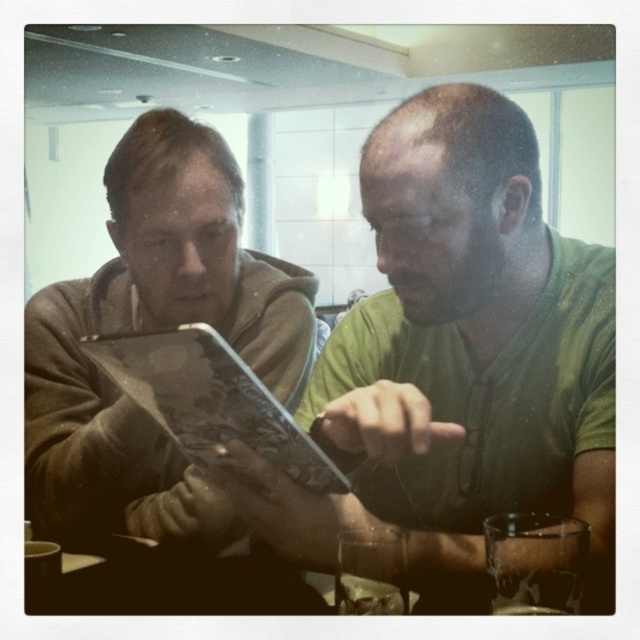
You are a photographer trying to capture a closeup of the matte brown hoodie at left. The camera you are using has a focal length of 50mm. To ensure the subject fills the frame, you need to position yourself at a specific distance. Given that the hoodie is at coordinates point 0.514, 0.241, can you determine if you should stand closer to the center of the room or move towards the edges?

The matte brown hoodie at left is located at point (154, 328), which is closer to the left side of the frame. To capture a closeup, you should move towards the edges of the room to get closer to the matte brown hoodie at left.

Looking at this image, you are a delivery person who needs to place a small package between the green matte shirt at center and the matte black tablet at center. The package is 15 centimeters long. Can you fit it between them without moving either object?

The distance between the green matte shirt at center and the matte black tablet at center is 16.50 centimeters. Since the package is 15 centimeters long, it can fit between them as there is enough space.

You are a delivery person who needs to place a small package between the matte brown hoodie at left and the matte black tablet at center. The package is 10 inches long. Can you fit it between them without moving either object?

The distance between the matte brown hoodie at left and the matte black tablet at center is 9.53 inches. Since the package is 10 inches long, it cannot fit between them without moving either object.